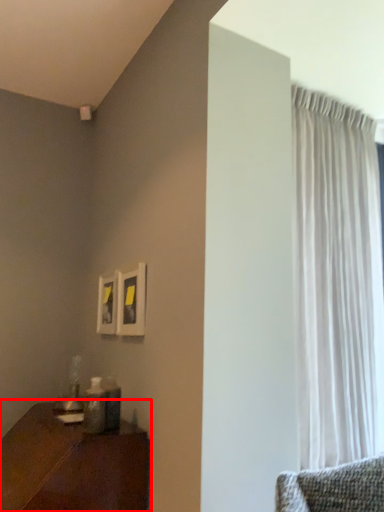
Question: Observing the image, what is the correct spatial positioning of table (annotated by the red box) in reference to curtain?

Choices:
 (A) left
 (B) right

Answer: (A)